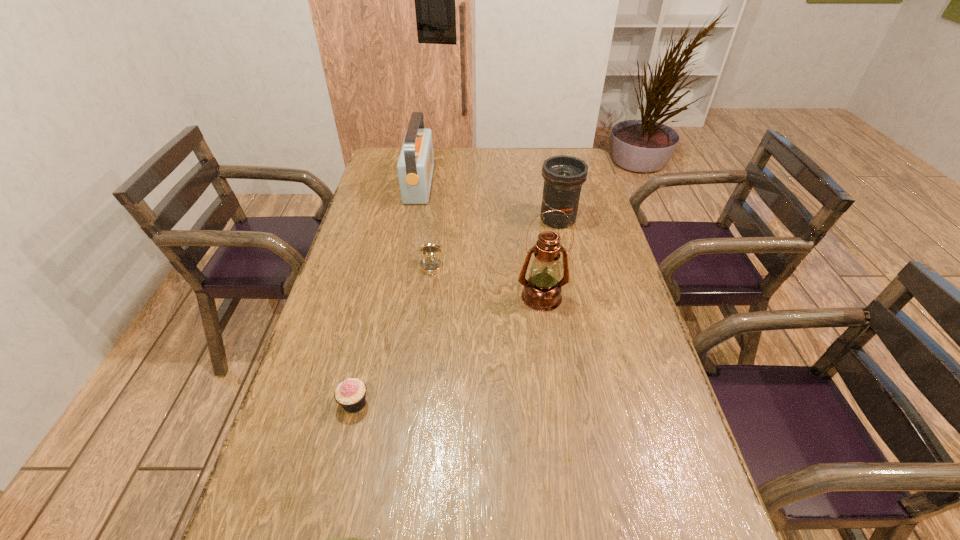
Identify the location of blank space that satisfies the following two spatial constraints: 1. on the front-facing side of the farthest object; 2. on the front side of the second nearest object. (377, 403).